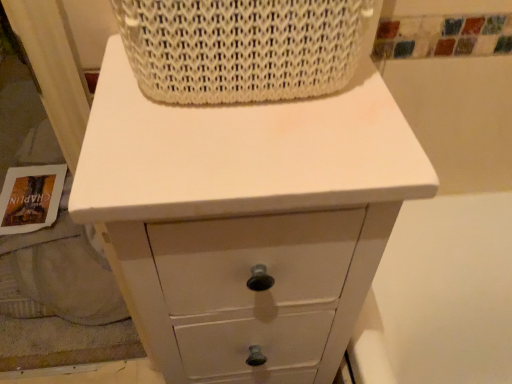
Locate an element on the screen. This screenshot has height=384, width=512. space that is in front of white woven basket at upper center is located at coordinates (240, 154).